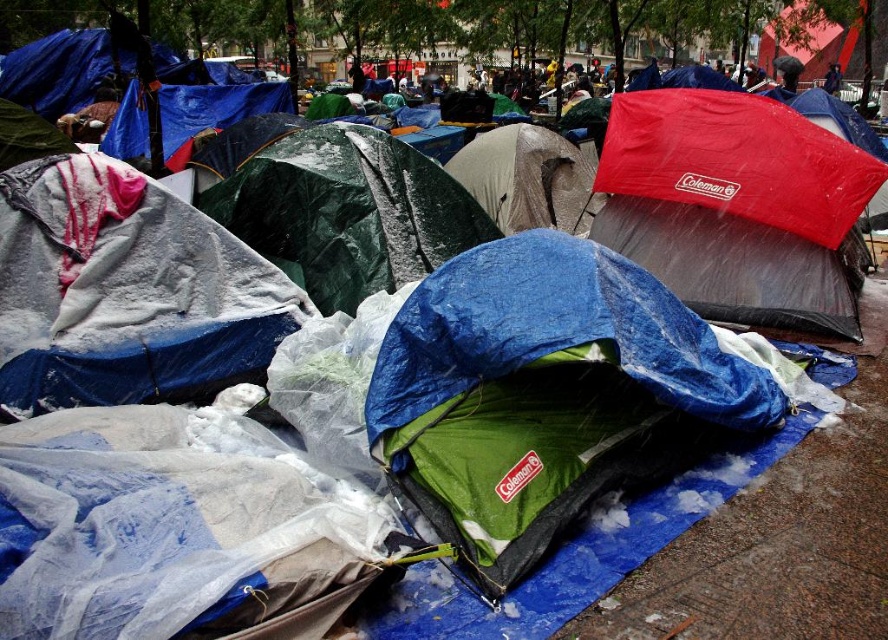
Question: Which point is closer to the camera taking this photo?

Choices:
 (A) (607, 122)
 (B) (535, 468)
 (C) (369, 154)

Answer: (B)

Question: Can you confirm if blue tarpaulin tent at center is thinner than red waterproof tent at upper right?

Choices:
 (A) yes
 (B) no

Answer: (A)

Question: Which object appears closest to the camera in this image?

Choices:
 (A) green tarp at center
 (B) red waterproof tent at upper right

Answer: (A)

Question: Considering the relative positions of red waterproof tent at upper right and green tarp at center in the image provided, where is red waterproof tent at upper right located with respect to green tarp at center?

Choices:
 (A) right
 (B) left

Answer: (A)

Question: Which point is closer to the camera taking this photo?

Choices:
 (A) (266, 115)
 (B) (424, 356)

Answer: (B)

Question: Is red waterproof tent at upper right further to the viewer compared to green tarp at center?

Choices:
 (A) no
 (B) yes

Answer: (B)